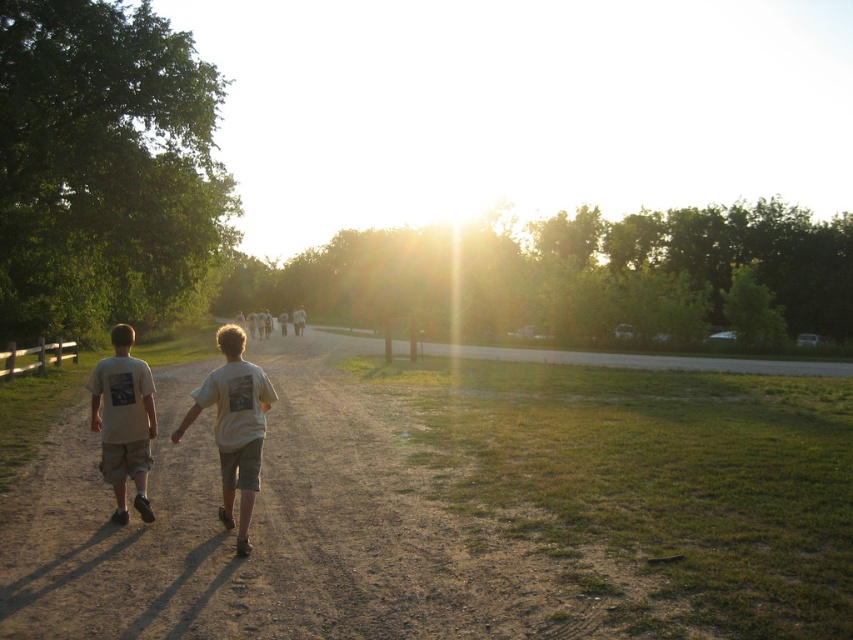
Which of these two, white cotton t-shirt at center or white cotton t-shirt at left, stands shorter?

white cotton t-shirt at center is shorter.

Is point (251, 432) less distant than point (115, 397)?

Yes.

What are the coordinates of `white cotton t-shirt at center` in the screenshot? It's located at (234, 426).

Is point (131, 404) more distant than point (285, 332)?

No, it is in front of (285, 332).

In the scene shown: Which is more to the right, white cotton t-shirt at left or white cotton couple at center?

From the viewer's perspective, white cotton t-shirt at left appears more on the right side.

Where is `white cotton t-shirt at left`? The width and height of the screenshot is (853, 640). white cotton t-shirt at left is located at coordinates (123, 420).

Is white cotton t-shirt at center further to camera compared to white cotton couple at center?

No, white cotton t-shirt at center is closer to the viewer.

The height and width of the screenshot is (640, 853). What are the coordinates of `white cotton t-shirt at center` in the screenshot? It's located at (234, 426).